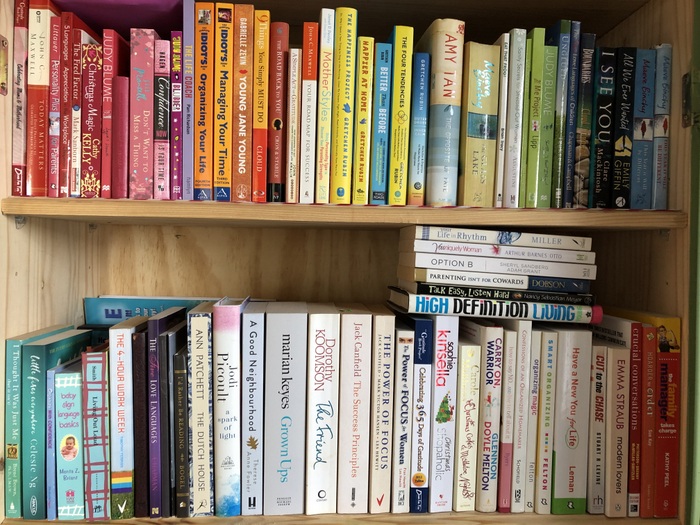
Image resolution: width=700 pixels, height=525 pixels. What are the coordinates of `books lying on their side` in the screenshot? It's located at (500, 239), (500, 253), (500, 261), (500, 274), (500, 289), (498, 311).